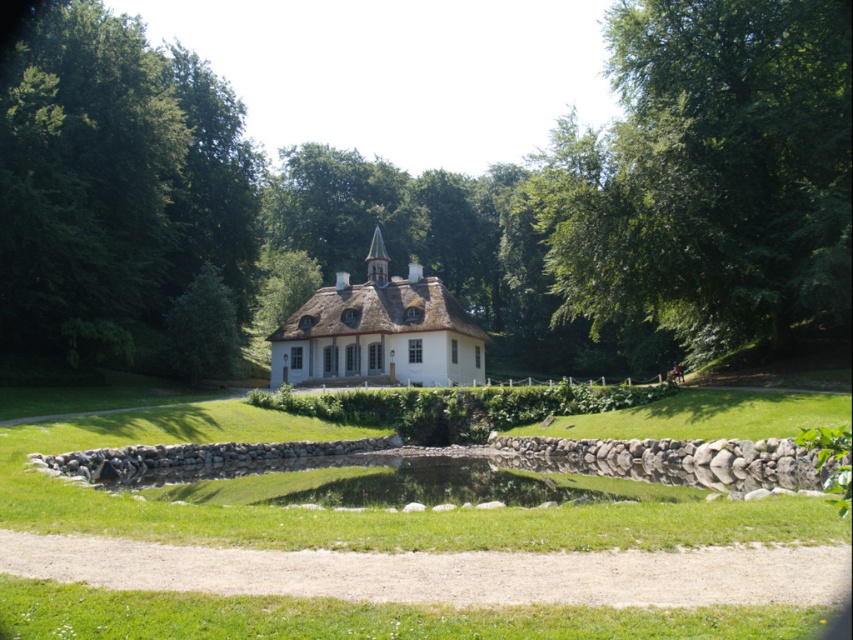
Question: Considering the relative positions of green leafy tree at upper right and green grassy pond at center in the image provided, where is green leafy tree at upper right located with respect to green grassy pond at center?

Choices:
 (A) right
 (B) left

Answer: (A)

Question: Can you confirm if green leafy tree at center is positioned to the right of green leafy tree at upper left?

Choices:
 (A) no
 (B) yes

Answer: (B)

Question: Is green leafy tree at center in front of green leafy tree at upper right?

Choices:
 (A) no
 (B) yes

Answer: (A)

Question: Which point is closer to the camera?

Choices:
 (A) (112, 186)
 (B) (410, 499)
 (C) (689, 163)

Answer: (B)

Question: Among these points, which one is farthest from the camera?

Choices:
 (A) (96, 108)
 (B) (389, 493)
 (C) (712, 68)
 (D) (717, 88)

Answer: (A)

Question: Which point appears farthest from the camera in this image?

Choices:
 (A) (381, 502)
 (B) (144, 113)
 (C) (672, 284)
 (D) (3, 337)

Answer: (B)